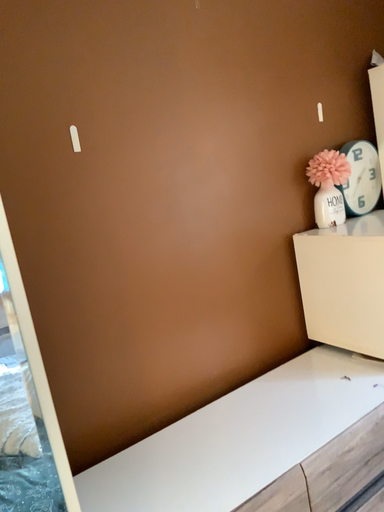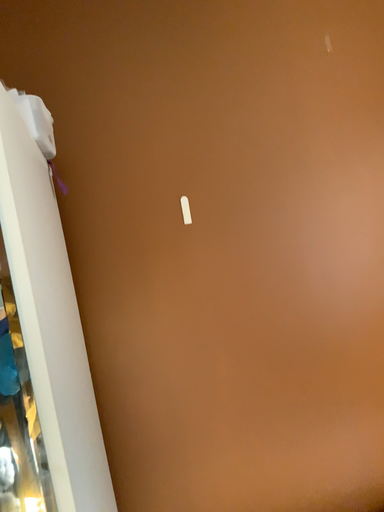
Question: Which way did the camera rotate in the video?

Choices:
 (A) rotated upward
 (B) rotated downward

Answer: (A)